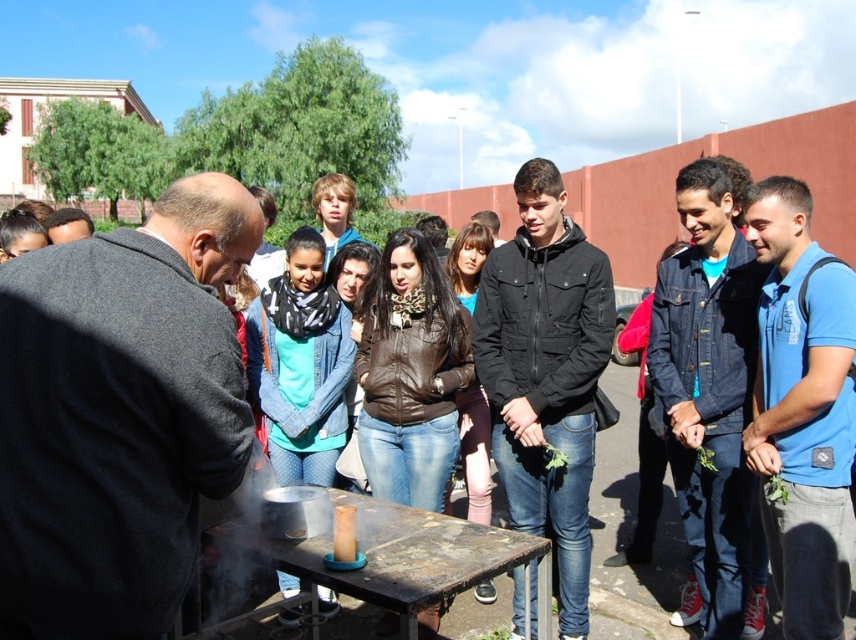
Based on the photo, which is more to the right, dark gray wool sweater at left or translucent glass jar at center?

translucent glass jar at center is more to the right.

How much distance is there between dark gray wool sweater at left and translucent glass jar at center?

dark gray wool sweater at left is 30.51 inches from translucent glass jar at center.

Describe the element at coordinates (119, 413) in the screenshot. I see `dark gray wool sweater at left` at that location.

Find the location of a particular element. This screenshot has height=640, width=856. dark gray wool sweater at left is located at coordinates (119, 413).

Does black leather jacket at center appear over blue cotton polo shirt at center right?

Yes, black leather jacket at center is above blue cotton polo shirt at center right.

The image size is (856, 640). I want to click on black leather jacket at center, so click(545, 372).

Identify the location of black leather jacket at center. This screenshot has width=856, height=640. (545, 372).

Describe the element at coordinates (545, 372) in the screenshot. The width and height of the screenshot is (856, 640). I see `black leather jacket at center` at that location.

Is black leather jacket at center wider than translucent glass jar at center?

Correct, the width of black leather jacket at center exceeds that of translucent glass jar at center.

The width and height of the screenshot is (856, 640). Describe the element at coordinates (545, 372) in the screenshot. I see `black leather jacket at center` at that location.

Where is `black leather jacket at center`? Image resolution: width=856 pixels, height=640 pixels. black leather jacket at center is located at coordinates (545, 372).